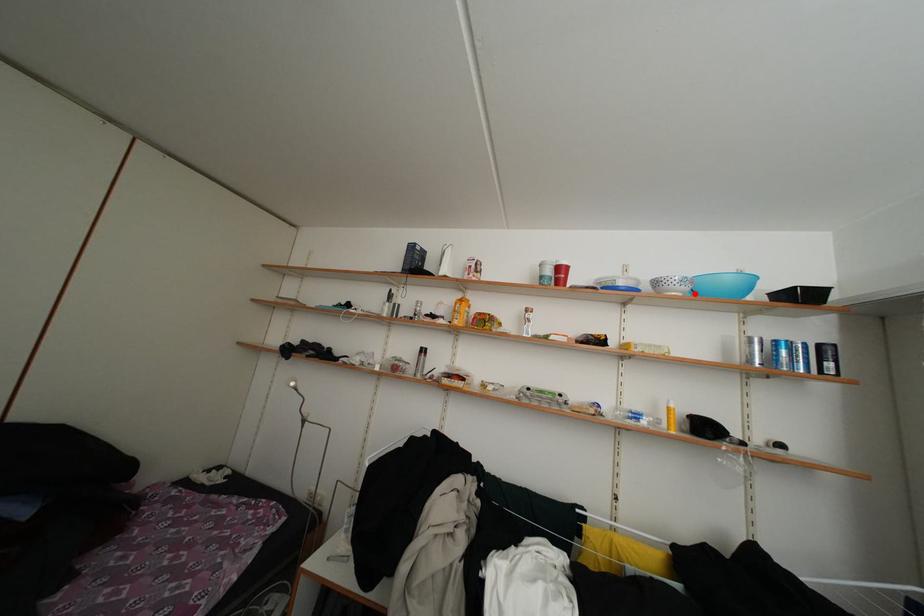
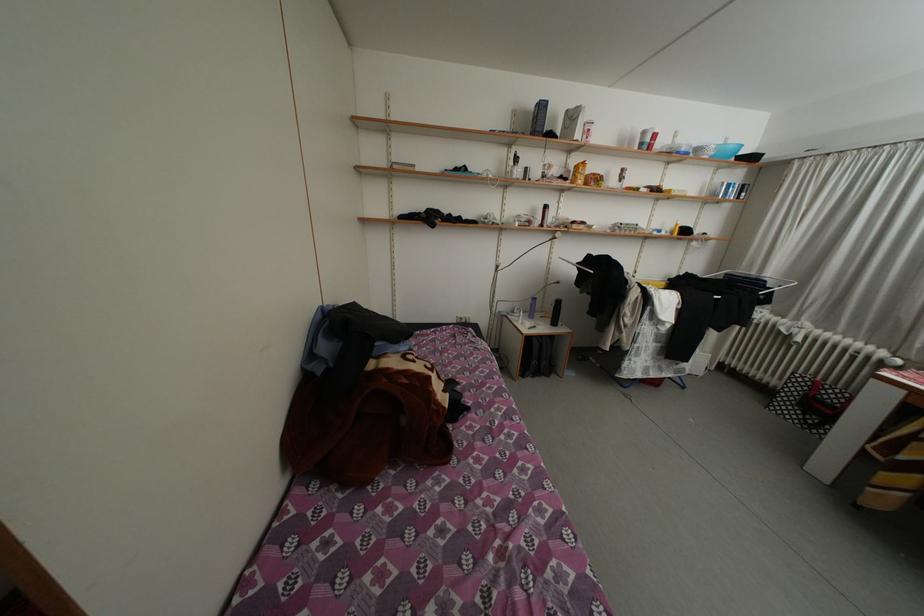
Locate, in the second image, the point that corresponds to the highlighted location in the first image.

(721, 159)